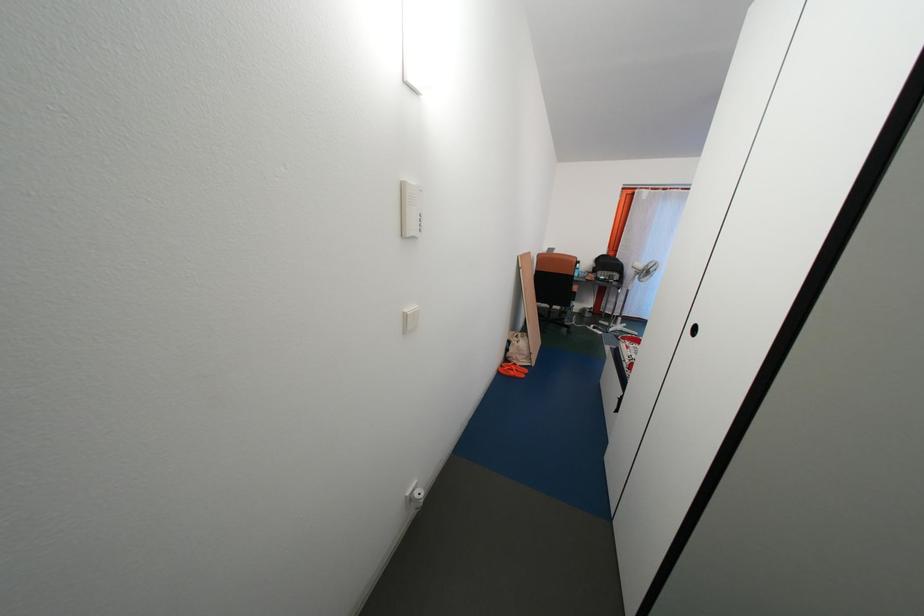
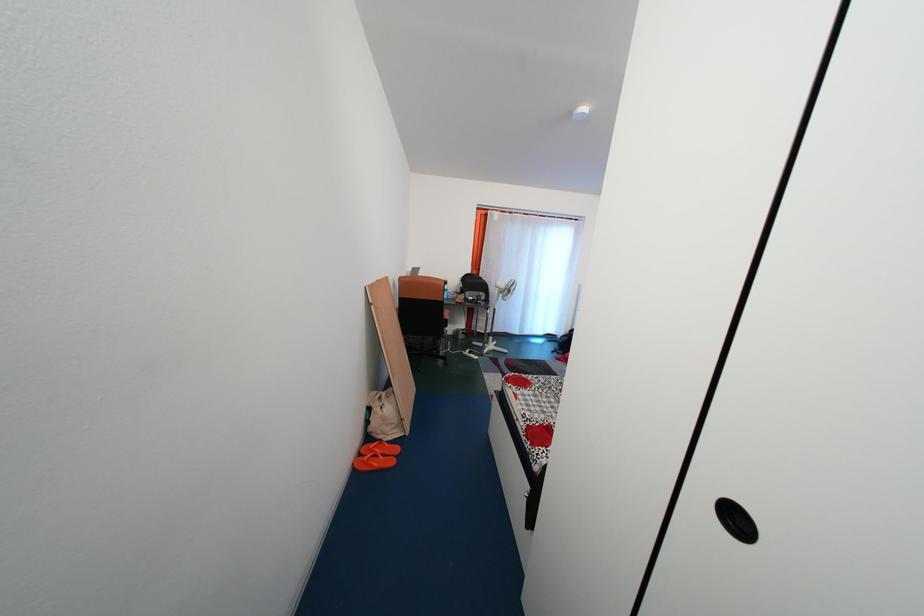
Question: The first image is from the beginning of the video and the second image is from the end. How did the camera likely rotate when shooting the video?

Choices:
 (A) Left
 (B) Right
 (C) Up
 (D) Down

Answer: (B)